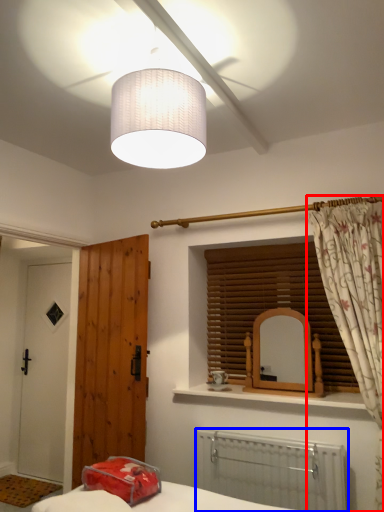
Question: Which object appears closest to the camera in this image, curtain (highlighted by a red box) or radiator (highlighted by a blue box)?

Choices:
 (A) curtain
 (B) radiator

Answer: (A)